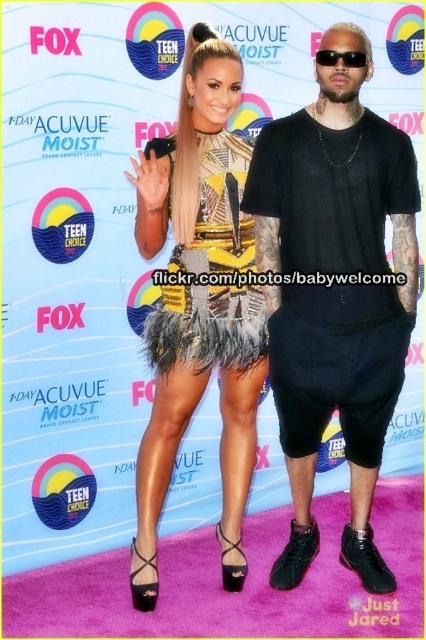
Can you confirm if black matte t-shirt at center is taller than feathered yellow dress at center?

Indeed, black matte t-shirt at center has a greater height compared to feathered yellow dress at center.

Does point (344, 195) come closer to viewer compared to point (238, 332)?

Yes, point (344, 195) is closer to viewer.

This screenshot has height=640, width=426. In order to click on black matte t-shirt at center in this screenshot , I will do `click(336, 289)`.

The width and height of the screenshot is (426, 640). I want to click on black matte t-shirt at center, so click(x=336, y=289).

Who is more forward, (371, 132) or (224, 237)?

Point (371, 132) is in front.

Is point (319, 154) more distant than point (184, 170)?

Yes, it is.

Between point (324, 106) and point (216, 307), which one is positioned in front?

Positioned in front is point (324, 106).

Find the location of a particular element. This screenshot has height=640, width=426. black matte t-shirt at center is located at coordinates (336, 289).

Does feathered dress at center appear on the left side of feathered yellow dress at center?

Indeed, feathered dress at center is positioned on the left side of feathered yellow dress at center.

Does feathered dress at center have a lesser height compared to feathered yellow dress at center?

No, feathered dress at center is not shorter than feathered yellow dress at center.

Is point (230, 330) positioned behind point (238, 316)?

No, (230, 330) is in front of (238, 316).

The height and width of the screenshot is (640, 426). I want to click on feathered dress at center, so click(195, 408).